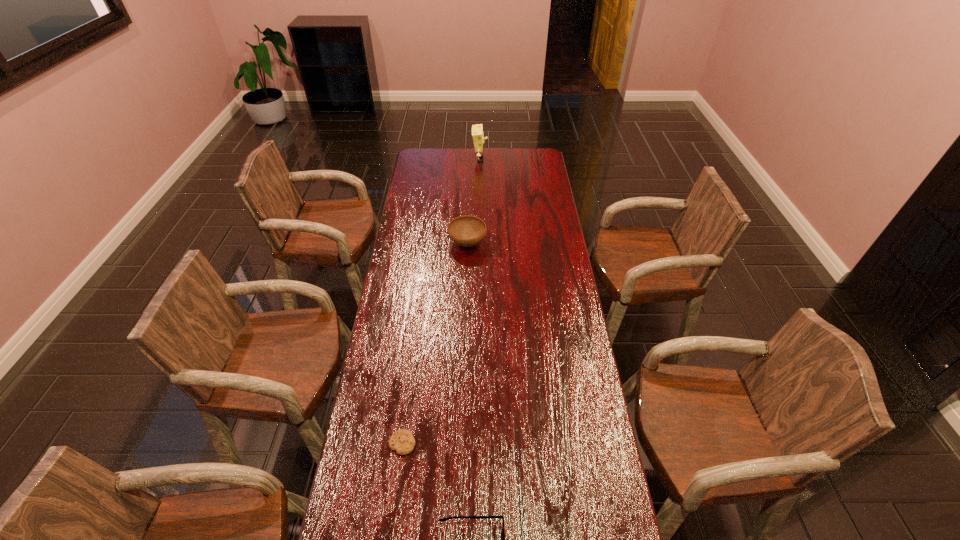
You are a GUI agent. You are given a task and a screenshot of the screen. Output one action in this format:
    pyautogui.click(x=<x>, y=<y>)
    Task: Click on the sponge
    This screenshot has height=540, width=960.
    Given the screenshot: What is the action you would take?
    pyautogui.click(x=477, y=130)

Locate an element on the screen. Image resolution: width=960 pixels, height=540 pixels. the tallest object is located at coordinates (477, 130).

Find the location of a particular element. the third shortest object is located at coordinates (466, 230).

The width and height of the screenshot is (960, 540). In order to click on the second farthest object in this screenshot , I will do `click(466, 230)`.

The height and width of the screenshot is (540, 960). I want to click on the third farthest object, so click(x=402, y=441).

You are a GUI agent. You are given a task and a screenshot of the screen. Output one action in this format:
    pyautogui.click(x=<x>, y=<y>)
    Task: Click on the shortest object
    The image size is (960, 540).
    Given the screenshot: What is the action you would take?
    pyautogui.click(x=402, y=441)

The width and height of the screenshot is (960, 540). What are the coordinates of `vacant space located on the face of the tallest object` in the screenshot? It's located at [x=511, y=159].

Locate an element on the screen. The width and height of the screenshot is (960, 540). vacant space located on the back of the bowl is located at coordinates (469, 189).

You are a GUI agent. You are given a task and a screenshot of the screen. Output one action in this format:
    pyautogui.click(x=<x>, y=<y>)
    Task: Click on the free space located 0.130m on the front of the cookie
    The height and width of the screenshot is (540, 960).
    Given the screenshot: What is the action you would take?
    tap(395, 504)

This screenshot has height=540, width=960. What are the coordinates of `object that is at the far edge` in the screenshot? It's located at (477, 130).